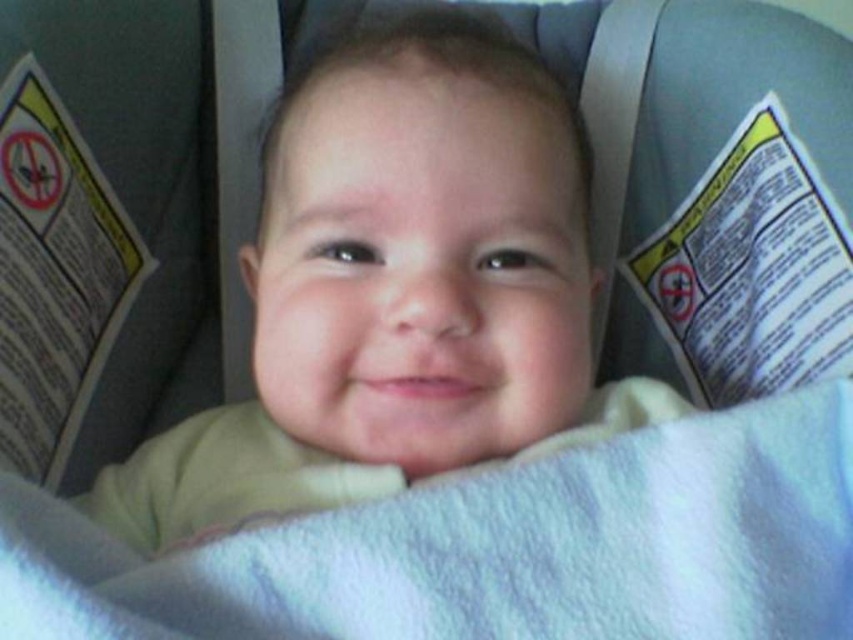
You are a parent checking the baby in the car seat. You see the smooth yellow shirt at center and the white soft blanket at center. Which item is taller?

The smooth yellow shirt at center is taller than the white soft blanket at center.

What are the coordinates of the smooth yellow shirt at center in the image?

The smooth yellow shirt at center is located at point (x=397, y=292).